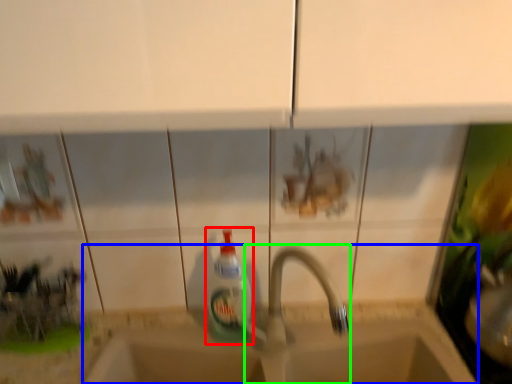
Question: Which object is positioned farthest from bottle (highlighted by a red box)? Select from sink (highlighted by a blue box) and tap (highlighted by a green box).

Choices:
 (A) sink
 (B) tap

Answer: (A)